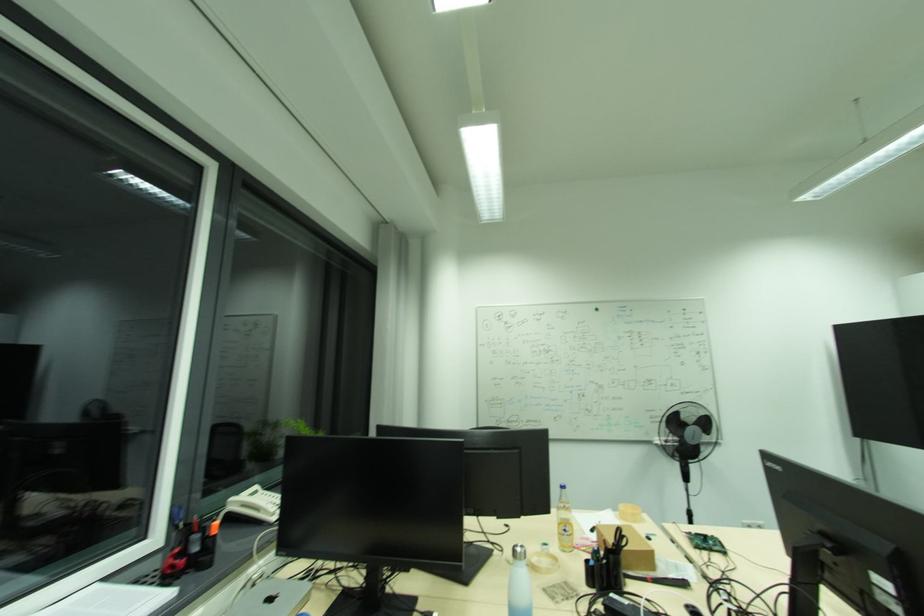
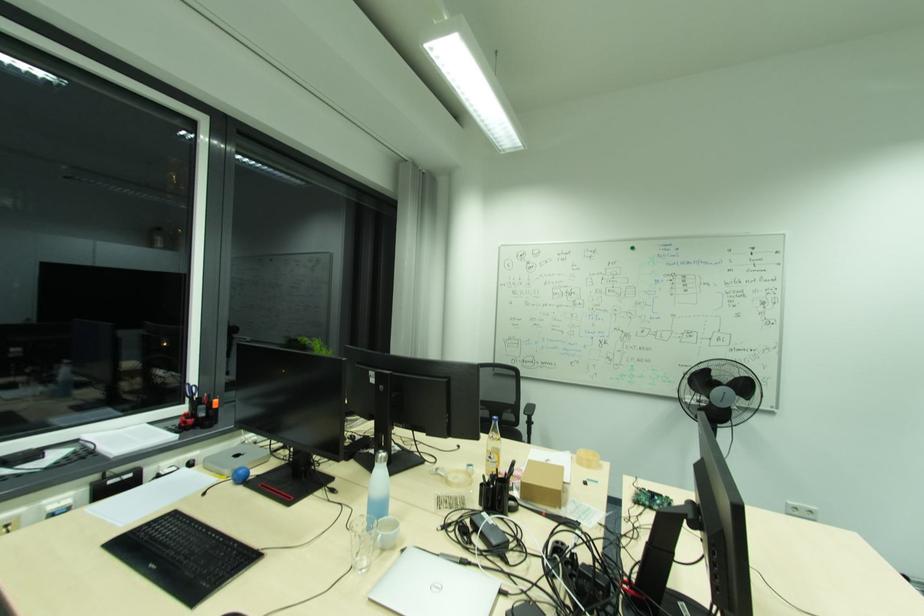
Find the pixel in the second image that matches (710,424) in the first image.

(748, 387)